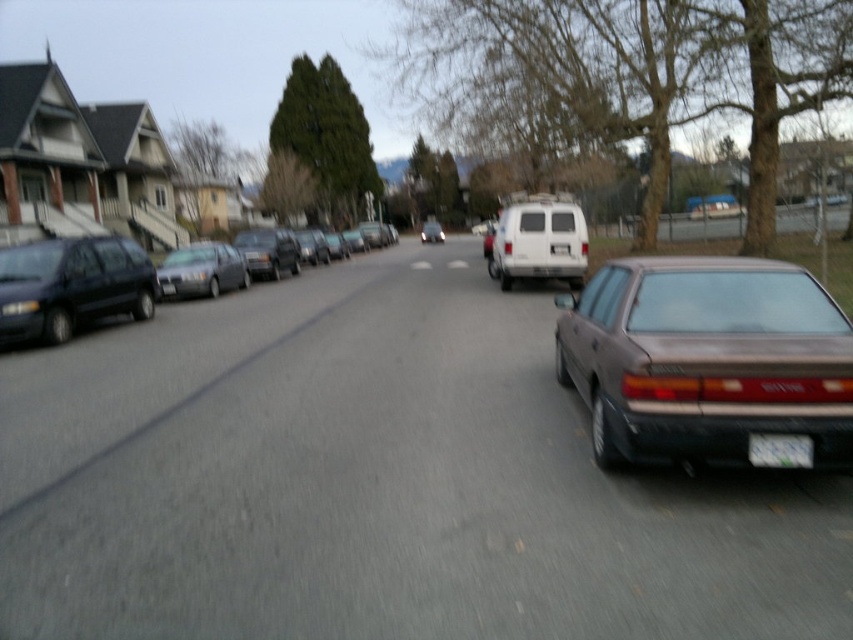
You are a delivery driver who needs to park your white matte van at center on the residential street. The parking spot is marked at coordinates point 0.378, 0.634. Is your van currently positioned correctly in the parking spot?

The white matte van at center is located at point (540, 241), so yes, the van is correctly positioned in the parking spot.

Based on the photo, you are a delivery driver who needs to park your vehicle in the residential area shown. Your vehicle is 2 meters wide. The white matte van at center and the shiny silver sedan at center are already parked. Can you determine if your vehicle will fit between them?

The white matte van at center is narrower than the shiny silver sedan at center. Since your vehicle is 2 meters wide, you need to check the available space between them. However, without knowing the exact distance between the two vehicles, it is impossible to determine if your vehicle will fit. Please measure the space before attempting to park.

You are a delivery person trying to park your shiny silver sedan at center in a residential area. There is already a brown matte sedan at center parked there. Can you park your car without overlapping the existing vehicle?

The brown matte sedan at center is positioned under the shiny silver sedan at center, so you cannot park your shiny silver sedan at center without overlapping the existing vehicle.